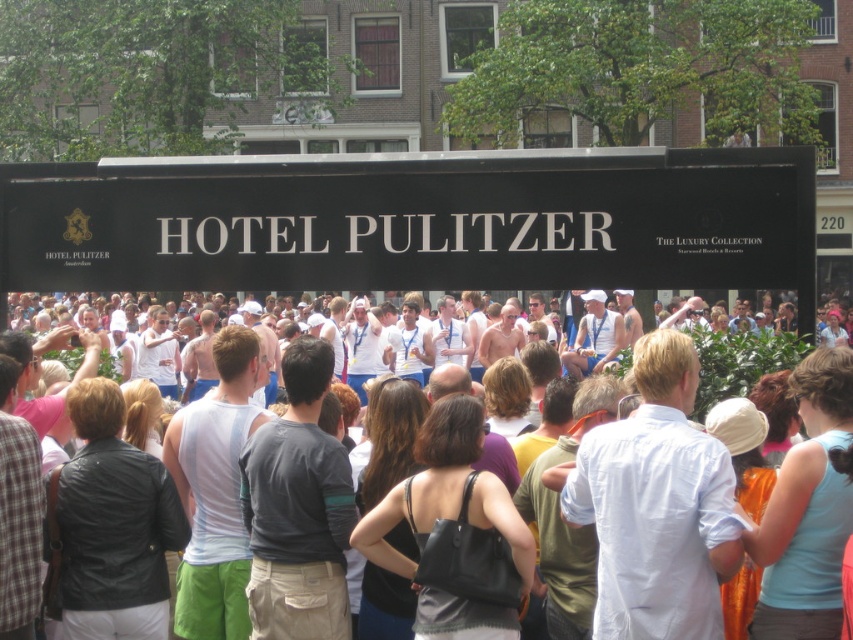
Question: Which point is closer to the camera?

Choices:
 (A) white cotton tank tops at center
 (B) black matte sign at upper center

Answer: (A)

Question: Can you confirm if black matte sign at upper center is bigger than white cotton tank tops at center?

Choices:
 (A) no
 (B) yes

Answer: (A)

Question: Is black matte sign at upper center bigger than white cotton tank tops at center?

Choices:
 (A) yes
 (B) no

Answer: (B)

Question: Which point is closer to the camera?

Choices:
 (A) black matte sign at upper center
 (B) white cotton tank tops at center

Answer: (B)

Question: Can you confirm if black matte sign at upper center is positioned above white cotton tank tops at center?

Choices:
 (A) yes
 (B) no

Answer: (A)